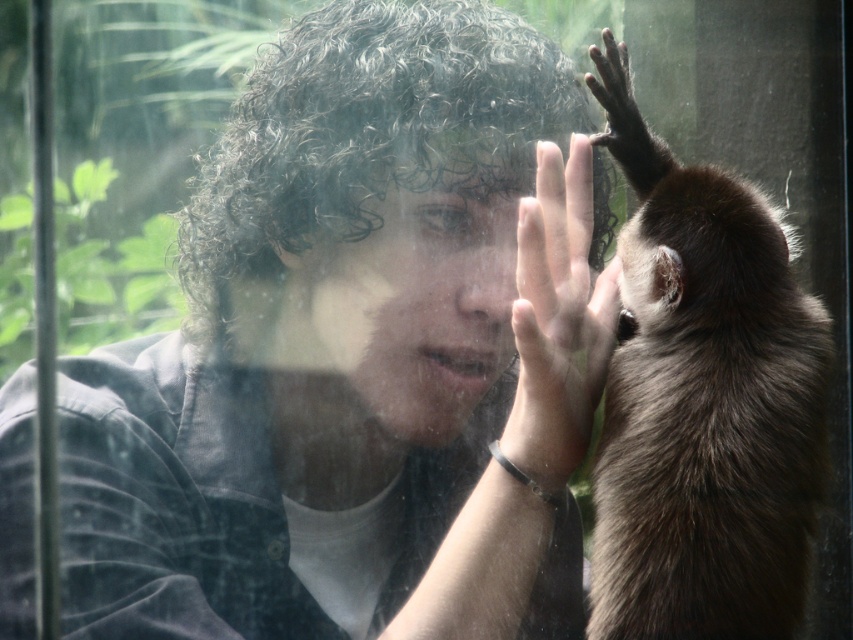
You are a zookeeper standing 1.2 meters tall. You want to reach the matte black shirt at center to hand out food. Can you reach it without any tools?

The matte black shirt at center is 1.14 meters away from the viewer. Since the zookeeper is 1.2 meters tall, they can likely reach it by extending their arm, as the distance is slightly less than their height.

You are standing in front of the glass barrier and notice two points marked on the glass. The first point is at coordinate point(280,380) and the second is at point(795,291). If you want to touch both points starting from the first one without moving your hand sideways, which direction should you move your hand after touching the first point?

Since point(280,380) is behind point(795,291), you should move your hand forward to reach the second point after touching the first one.

You are a zookeeper observing the scene through the glass barrier. You notice the matte black shirt at center and the smooth skin hand at center. Which object is positioned lower in the image?

The matte black shirt at center is located below the smooth skin hand at center, so the matte black shirt at center is positioned lower in the image.